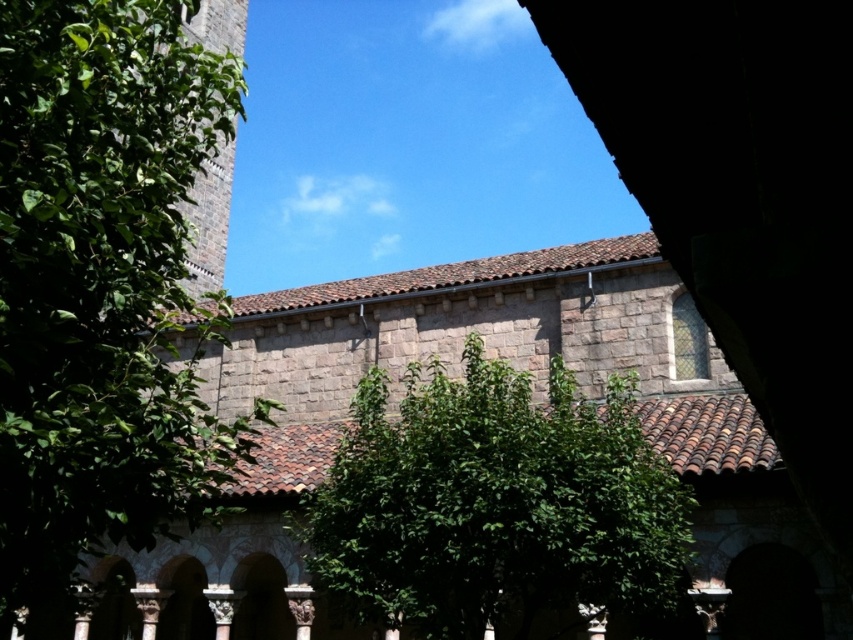
Looking at this image, how far apart are green leafy tree at upper left and green leafy tree at center?

green leafy tree at upper left is 10.56 meters from green leafy tree at center.

From the picture: Can you confirm if green leafy tree at upper left is thinner than green leafy tree at center?

Incorrect, green leafy tree at upper left's width is not less than green leafy tree at center's.

The height and width of the screenshot is (640, 853). What do you see at coordinates (102, 284) in the screenshot? I see `green leafy tree at upper left` at bounding box center [102, 284].

At what (x,y) coordinates should I click in order to perform the action: click on green leafy tree at upper left. Please return your answer as a coordinate pair (x, y). The height and width of the screenshot is (640, 853). Looking at the image, I should click on (102, 284).